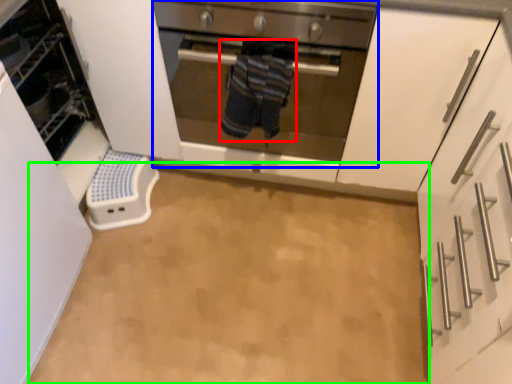
Question: Considering the real-world distances, which object is farthest from person (highlighted by a red box)? oven (highlighted by a blue box) or plain (highlighted by a green box)?

Choices:
 (A) oven
 (B) plain

Answer: (B)